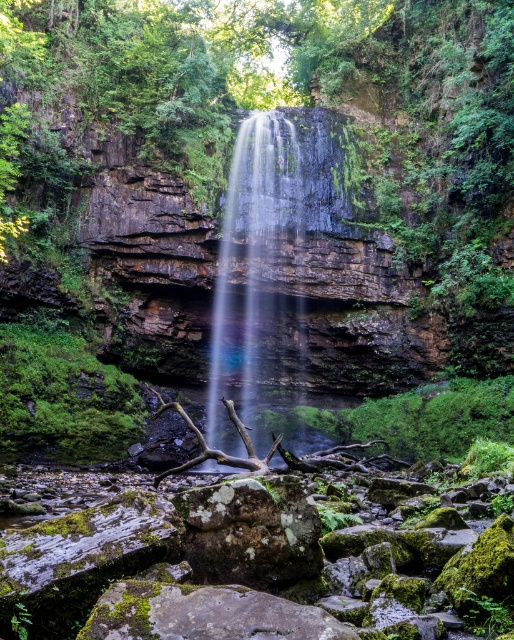
Question: From the image, what is the correct spatial relationship of translucent glass waterfall at center in relation to green mossy rock at center?

Choices:
 (A) above
 (B) below

Answer: (A)

Question: Which of these objects is positioned farthest from the translucent glass waterfall at center?

Choices:
 (A) mossy rock at center
 (B) green mossy rock at center

Answer: (B)

Question: Does translucent glass waterfall at center appear over green mossy rock at center?

Choices:
 (A) yes
 (B) no

Answer: (A)

Question: Which object is farther from the camera taking this photo?

Choices:
 (A) green mossy rock at center
 (B) translucent glass waterfall at center

Answer: (B)

Question: Does translucent glass waterfall at center appear on the right side of green mossy rock at center?

Choices:
 (A) yes
 (B) no

Answer: (B)

Question: Based on their relative distances, which object is nearer to the mossy rock at center?

Choices:
 (A) green mossy rock at center
 (B) translucent glass waterfall at center

Answer: (A)